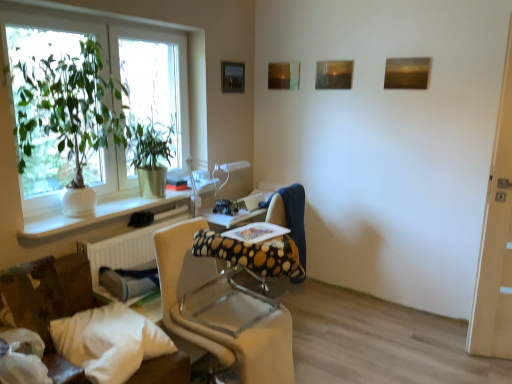
This screenshot has height=384, width=512. Find the location of `free spot below transparent glass door at right (from a real-world perspective)`. free spot below transparent glass door at right (from a real-world perspective) is located at coordinates (489, 358).